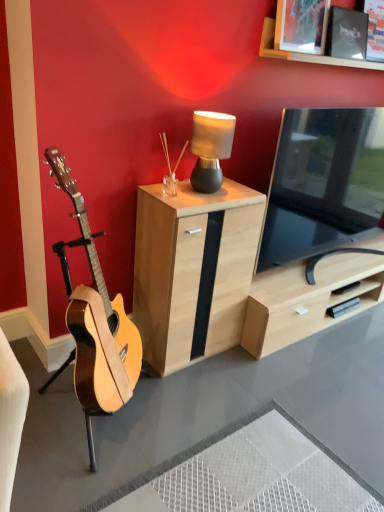
Identify the location of free area below matte black lamp at center (from a real-world perspective). This screenshot has height=512, width=384. (218, 189).